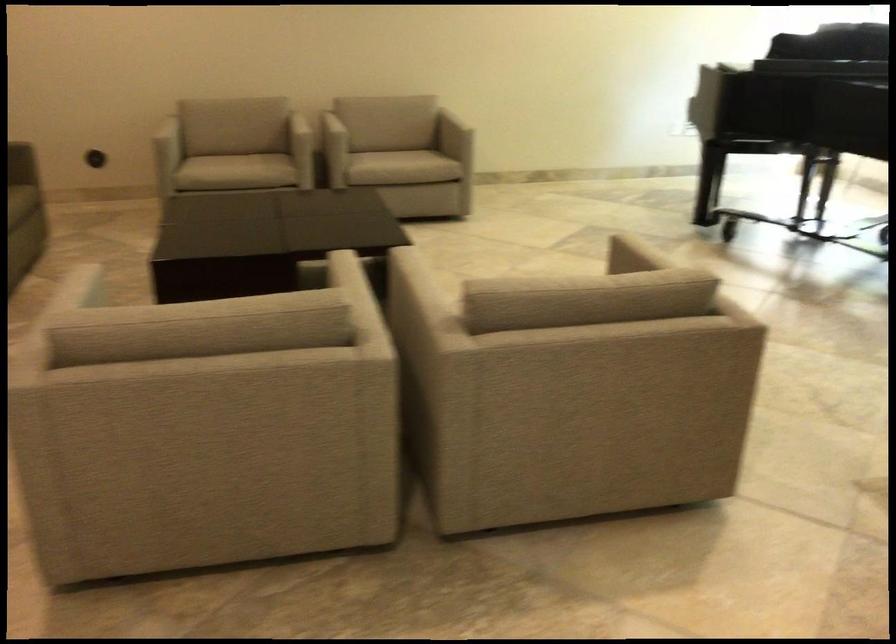
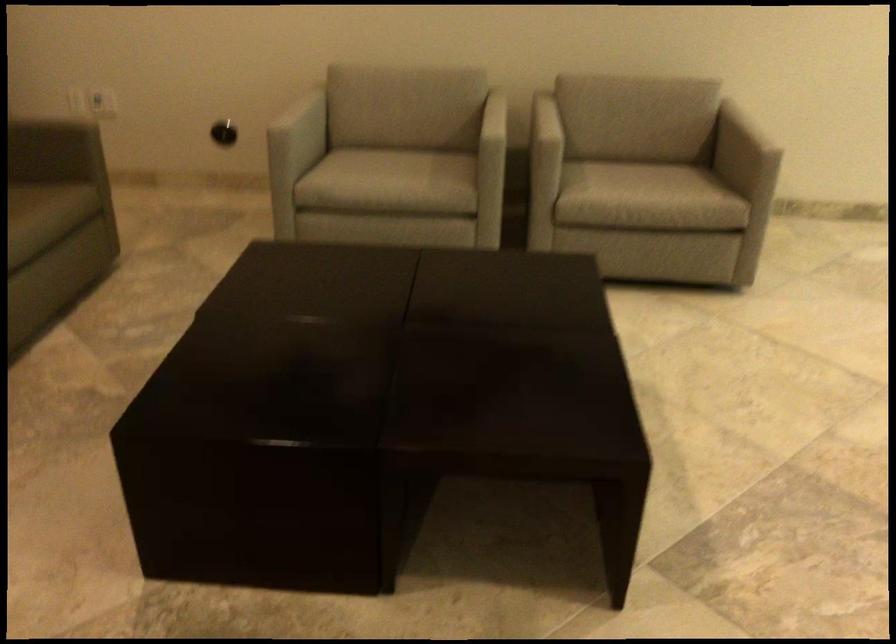
In the second image, find the point that corresponds to [168,138] in the first image.

(304, 124)